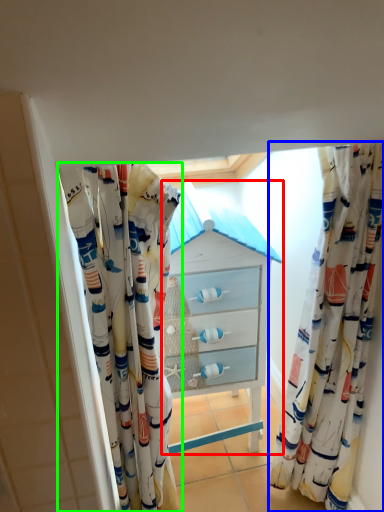
Question: Which object is positioned farthest from chest of drawers (highlighted by a red box)? Select from curtain (highlighted by a blue box) and curtain (highlighted by a green box).

Choices:
 (A) curtain
 (B) curtain

Answer: (A)